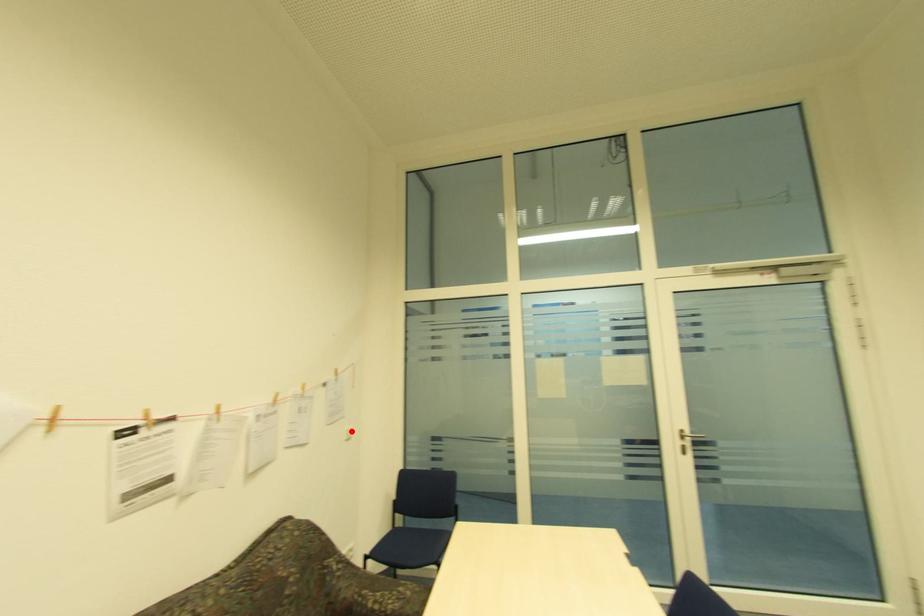
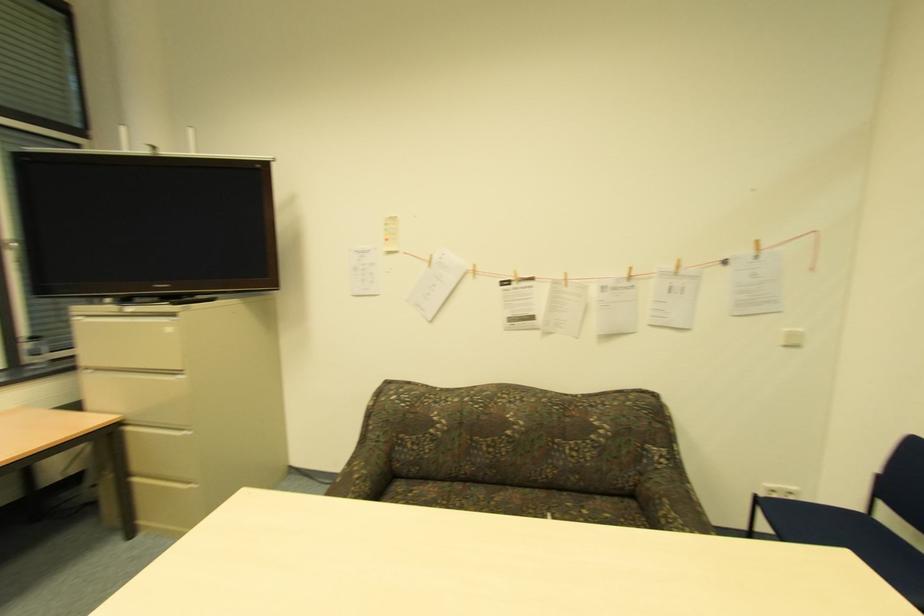
Where in the second image is the point corresponding to the highlighted location from the first image?

(792, 334)